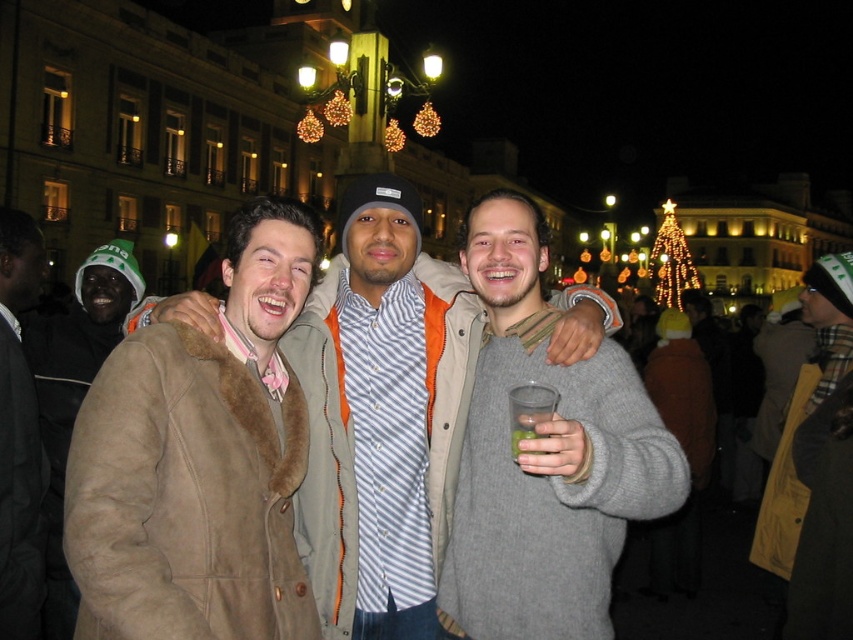
Who is shorter, suede jacket at center or gray sweater at center?

With less height is gray sweater at center.

Between suede jacket at center and gray sweater at center, which one is positioned lower?

suede jacket at center

Who is more distant from viewer, (334, 275) or (498, 428)?

Point (334, 275)

Identify the location of suede jacket at center. The image size is (853, 640). (381, 416).

Can you confirm if gray sweater at center is bigger than dark gray wool coat at left?

Correct, gray sweater at center is larger in size than dark gray wool coat at left.

Which is above, gray sweater at center or dark gray wool coat at left?

gray sweater at center is higher up.

Is point (614, 552) less distant than point (3, 518)?

No, (614, 552) is further to viewer.

Locate an element on the screen. gray sweater at center is located at coordinates (544, 458).

Is suede jacket at center to the left of dark brown fur coat at left from the viewer's perspective?

No, suede jacket at center is not to the left of dark brown fur coat at left.

Which is behind, point (358, 435) or point (35, 372)?

Point (35, 372)

Where is `suede jacket at center`? This screenshot has height=640, width=853. suede jacket at center is located at coordinates (381, 416).